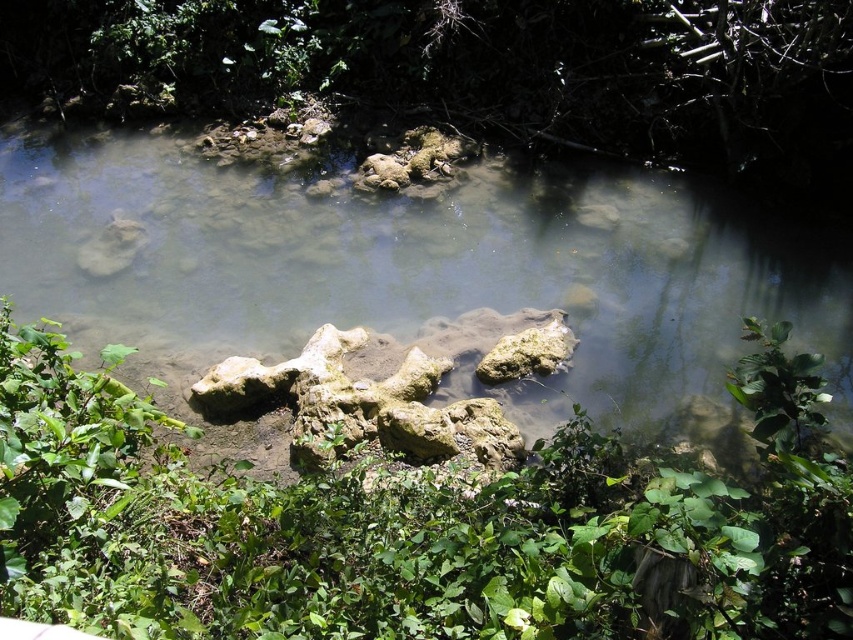
Does green leafy vegetation at center have a larger size compared to gray rock at center?

Yes.

Which is behind, point (74, 513) or point (128, 264)?

The point (128, 264) is behind.

At what (x,y) coordinates should I click in order to perform the action: click on green leafy vegetation at center. Please return your answer as a coordinate pair (x, y). The width and height of the screenshot is (853, 640). Looking at the image, I should click on (409, 518).